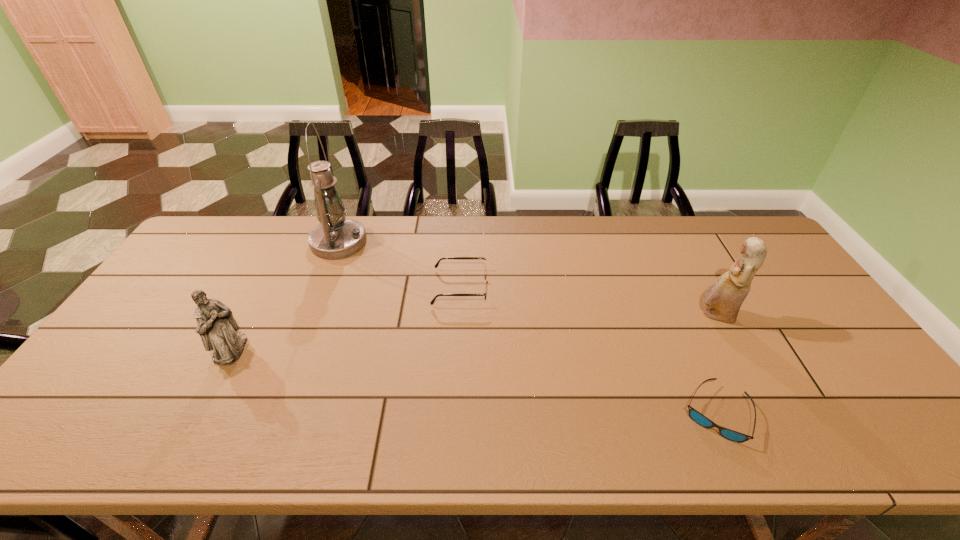
Locate an element on the screen. vacant space at the right edge of the desktop is located at coordinates (842, 363).

In the image, there is a desktop. Identify the location of vacant area at the near right corner. (902, 455).

Where is `free space between the left figurine and the fourth object from right to left`? free space between the left figurine and the fourth object from right to left is located at coordinates 285,296.

Identify the location of free space between the left figurine and the spectacles. (346, 319).

Find the location of a particular element. The image size is (960, 540). free space between the tallest object and the fourth tallest object is located at coordinates (399, 265).

Locate an element on the screen. The width and height of the screenshot is (960, 540). vacant region between the nearer figurine and the shortest object is located at coordinates (473, 382).

You are a GUI agent. You are given a task and a screenshot of the screen. Output one action in this format:
    pyautogui.click(x=<x>, y=<y>)
    Task: Click on the free spot between the spectacles and the oil lamp
    The height and width of the screenshot is (540, 960).
    Given the screenshot: What is the action you would take?
    pyautogui.click(x=399, y=265)

You are a GUI agent. You are given a task and a screenshot of the screen. Output one action in this format:
    pyautogui.click(x=<x>, y=<y>)
    Task: Click on the free space between the fourth tallest object and the oil lamp
    
    Given the screenshot: What is the action you would take?
    pyautogui.click(x=399, y=265)

Where is `free space between the tallest object and the taller figurine`? The width and height of the screenshot is (960, 540). free space between the tallest object and the taller figurine is located at coordinates (527, 279).

Locate an element on the screen. The image size is (960, 540). free spot between the second shortest object and the sunglasses is located at coordinates (588, 350).